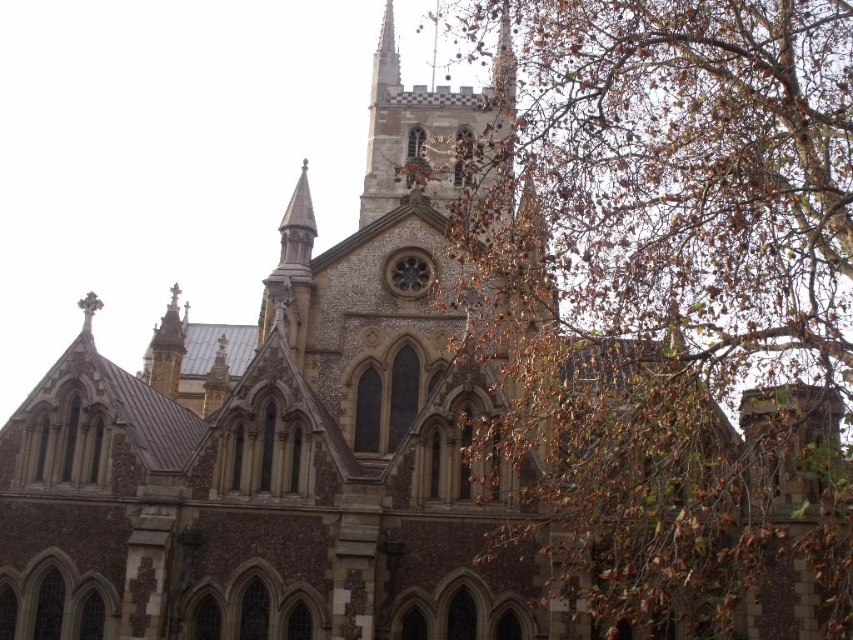
You are a window cleaner standing on the ground in front of the church. You need to clean both the brown leafy branches at upper right and the brown stone clock tower at center. Which object is wider so you can prioritize the one requiring more effort?

The brown leafy branches at upper right might be wider than brown stone clock tower at center, so you should prioritize cleaning the brown leafy branches at upper right first as they may require more effort due to their width.

You are an architect analyzing the church facade. You notice a specific point at coordinates point (666, 289). Based on the scene description, can you determine what architectural feature or element this point is located on?

The point (666, 289) is located on the brown leafy branches at upper right.